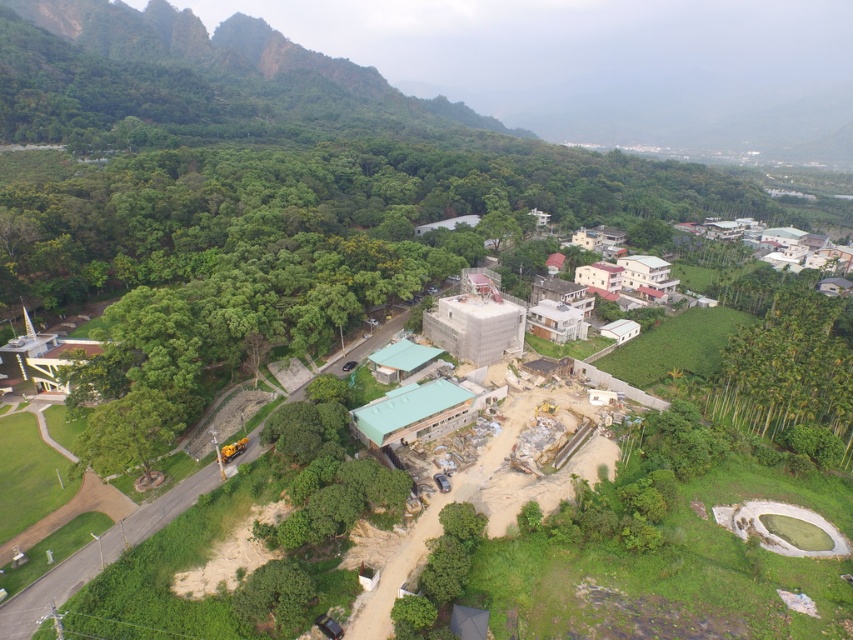
You are a drone operator tasked with capturing aerial footage of the scene. You need to fly your drone from your current position to the green leafy trees at lower right. Given that your drone has a maximum flight range of 100 meters before needing to return, will you be able to reach the trees without needing to recharge?

The green leafy trees at lower right and viewer are 104.87 meters apart, which exceeds the drone maximum flight range of 100 meters. Therefore, the drone will not be able to reach the trees without recharging.

You are standing at the point labeled point (x=807, y=292) in the rural area transitioning into a residential zone. You want to walk to the nearest residential building cluster with white and red roofs. Given that the distance between you and the viewer is 175.12 meters, can you estimate how far you need to walk to reach the cluster?

The point labeled point (x=807, y=292) is 175.12 meters away from the viewer. Since the residential building cluster with white and red roofs is located to the right of the scene, you would need to walk approximately 175.12 meters to reach it.